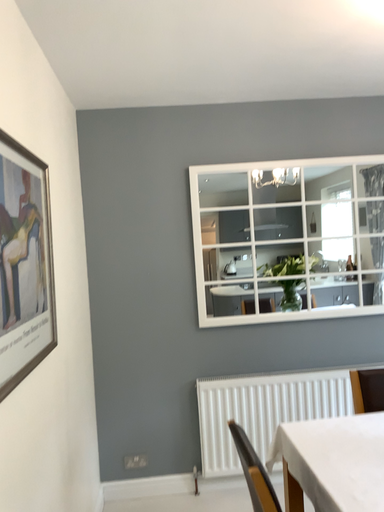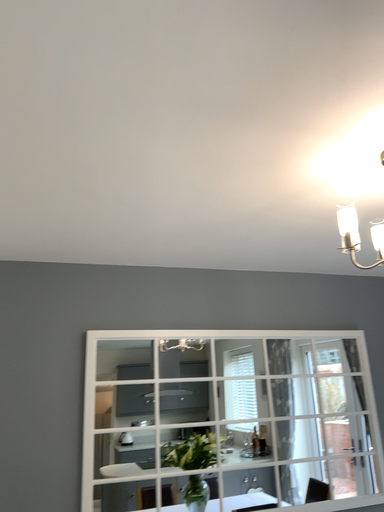
Question: Which way did the camera rotate in the video?

Choices:
 (A) rotated left
 (B) rotated right

Answer: (B)